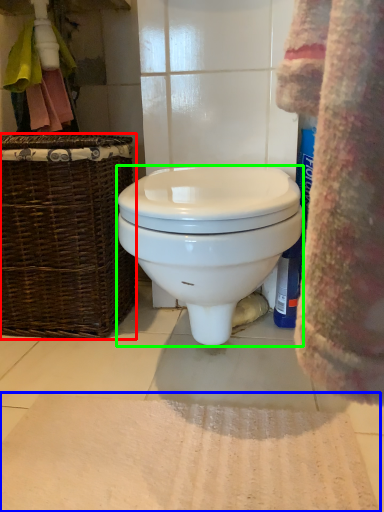
Question: Considering the real-world distances, which object is farthest from picnic basket (highlighted by a red box)? bath mat (highlighted by a blue box) or toilet (highlighted by a green box)?

Choices:
 (A) bath mat
 (B) toilet

Answer: (A)